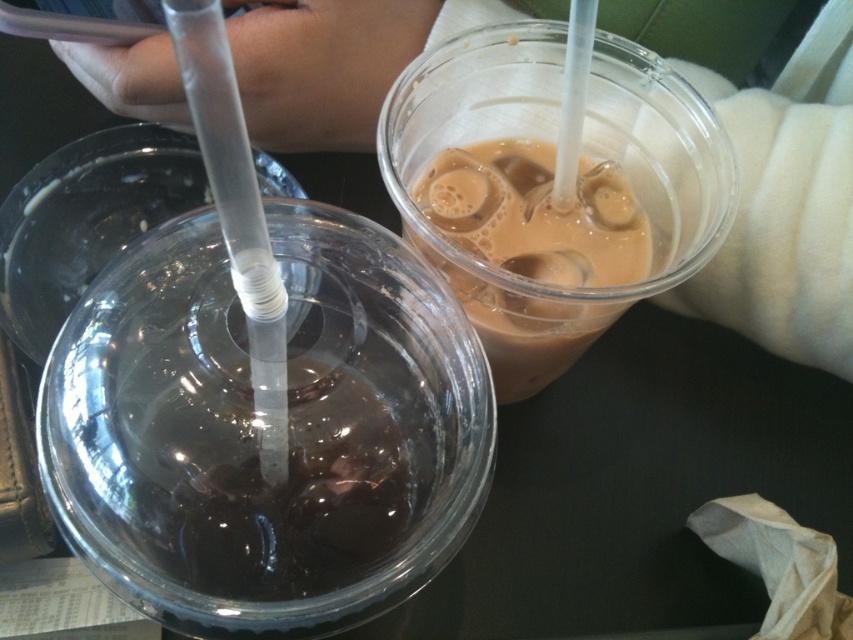
Question: Does skinny white arm at upper center appear under brown matte plastic cup at upper right?

Choices:
 (A) no
 (B) yes

Answer: (A)

Question: Does skinny white arm at upper center have a smaller size compared to brown matte plastic cup at upper right?

Choices:
 (A) yes
 (B) no

Answer: (B)

Question: Observing the image, what is the correct spatial positioning of skinny white arm at upper center in reference to brown matte plastic cup at upper right?

Choices:
 (A) below
 (B) above

Answer: (B)

Question: Which object is closer to the camera taking this photo?

Choices:
 (A) skinny white arm at upper center
 (B) brown matte plastic cup at upper right

Answer: (B)